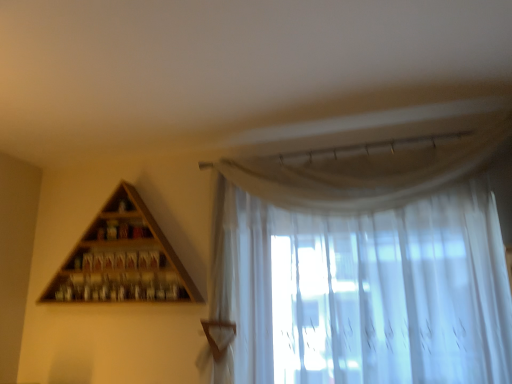
Question: Is wooden triangle at upper left to the left or to the right of sheer white curtain at upper right in the image?

Choices:
 (A) left
 (B) right

Answer: (A)

Question: Does point (174, 299) appear closer or farther from the camera than point (432, 190)?

Choices:
 (A) closer
 (B) farther

Answer: (B)

Question: From the image's perspective, is wooden triangle at upper left located above or below sheer white curtain at upper right?

Choices:
 (A) above
 (B) below

Answer: (B)

Question: Is sheer white curtain at upper right bigger or smaller than wooden triangle at upper left?

Choices:
 (A) small
 (B) big

Answer: (B)

Question: In terms of width, does sheer white curtain at upper right look wider or thinner when compared to wooden triangle at upper left?

Choices:
 (A) wide
 (B) thin

Answer: (A)

Question: Visually, is sheer white curtain at upper right positioned to the left or to the right of wooden triangle at upper left?

Choices:
 (A) left
 (B) right

Answer: (B)

Question: From the image's perspective, is sheer white curtain at upper right located above or below wooden triangle at upper left?

Choices:
 (A) below
 (B) above

Answer: (B)